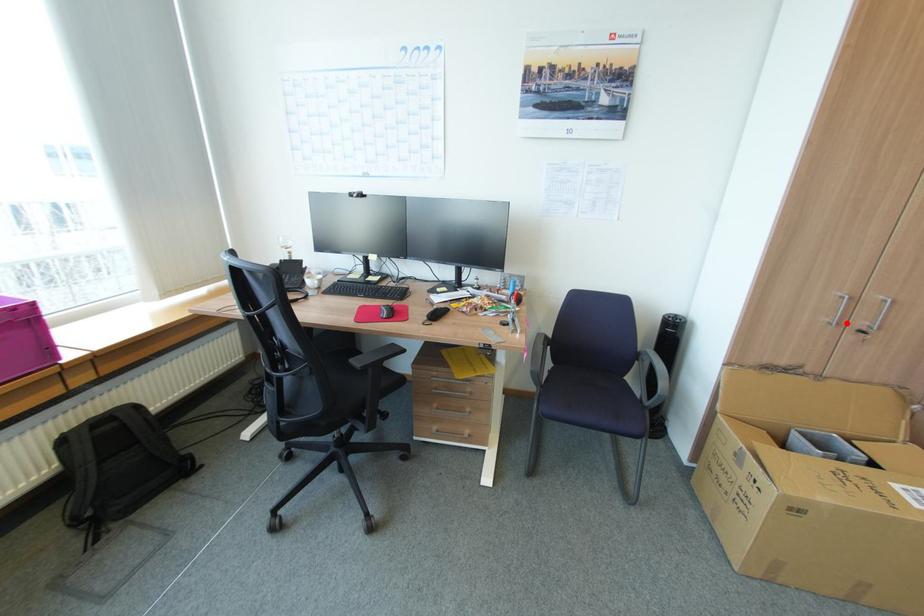
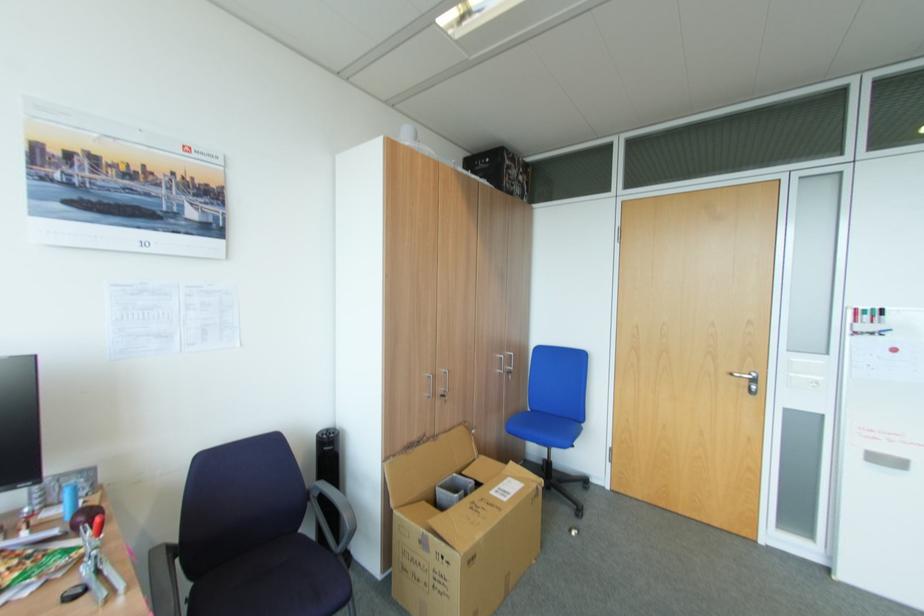
Locate, in the second image, the point that corresponds to the highlighted location in the first image.

(440, 394)